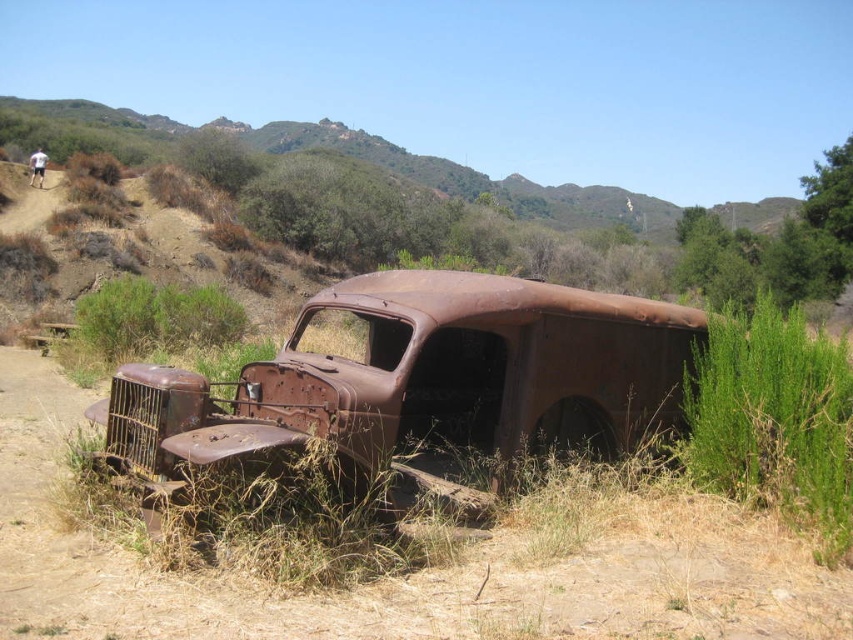
Question: Where is rusty metal truck at center located in relation to brown rusted car at lower left in the image?

Choices:
 (A) left
 (B) right

Answer: (B)

Question: Which of the following is the closest to the observer?

Choices:
 (A) (784, 202)
 (B) (448, 324)

Answer: (B)

Question: Which point is farther from the camera taking this photo?

Choices:
 (A) (463, 188)
 (B) (601, 300)

Answer: (A)

Question: Does rusty metal truck at center have a greater width compared to brown rusted car at lower left?

Choices:
 (A) no
 (B) yes

Answer: (A)

Question: Does rusty metal truck at center appear on the left side of brown rusted car at lower left?

Choices:
 (A) no
 (B) yes

Answer: (A)